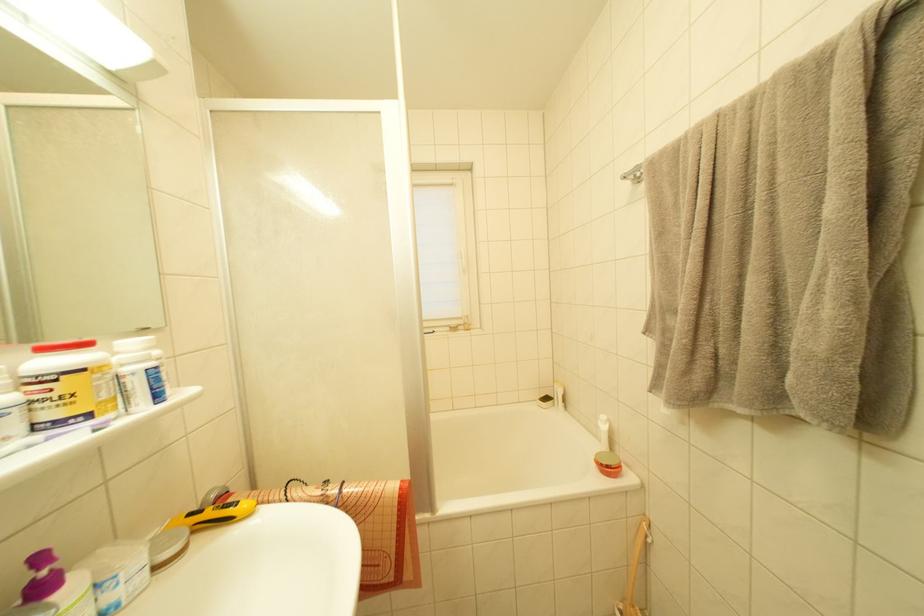
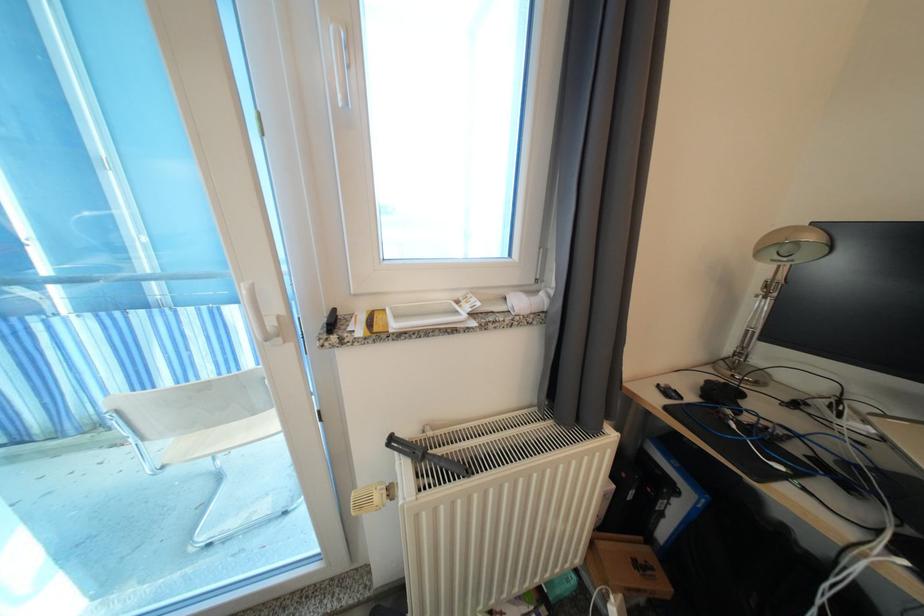
The images are taken continuously from a first-person perspective. In which direction are you moving?

The movement direction of the cameraman is right, forward.